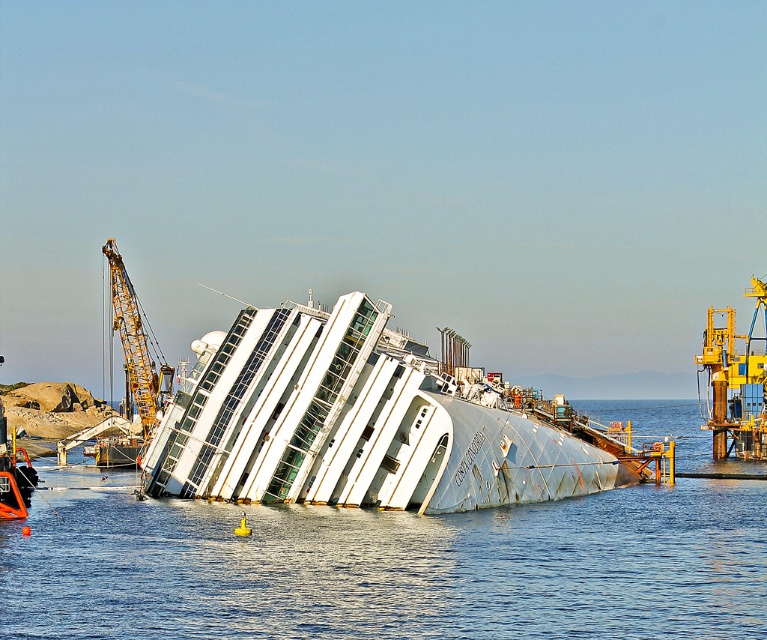
Question: Which of the following is the farthest from the observer?

Choices:
 (A) clear blue water at center
 (B) yellow metallic crane at upper left

Answer: (B)

Question: Among these objects, which one is nearest to the camera?

Choices:
 (A) yellow metallic crane at upper left
 (B) clear blue water at center

Answer: (B)

Question: Can you confirm if white metallic ship at center is positioned above yellow metallic crane at upper left?

Choices:
 (A) no
 (B) yes

Answer: (A)

Question: Does clear blue water at center appear under yellow metallic crane at upper left?

Choices:
 (A) no
 (B) yes

Answer: (B)

Question: From the image, what is the correct spatial relationship of clear blue water at center in relation to white metallic ship at center?

Choices:
 (A) left
 (B) right

Answer: (B)

Question: Among these points, which one is nearest to the camera?

Choices:
 (A) (165, 387)
 (B) (275, 324)
 (C) (114, 474)

Answer: (B)